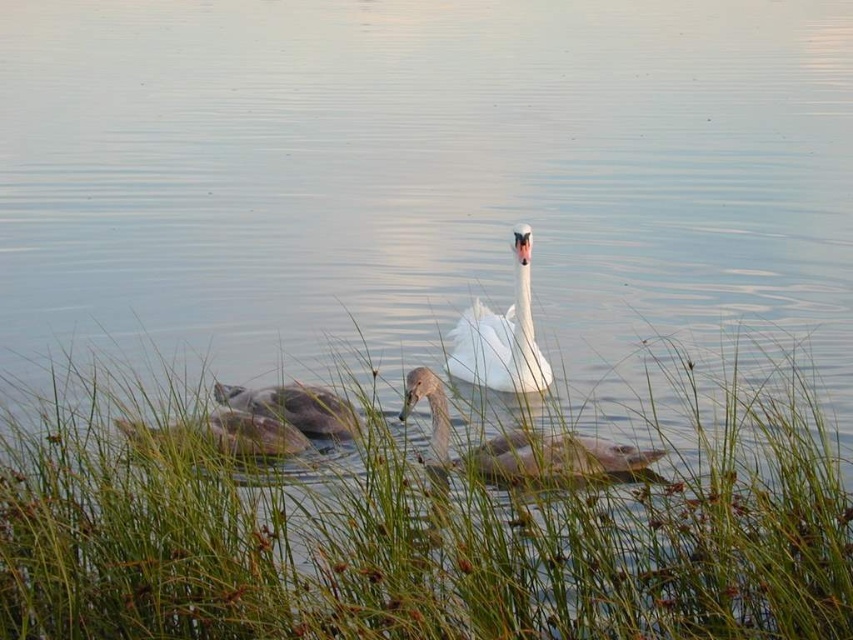
Does green grass at lower center appear on the right side of gray matte duck at lower center?

Correct, you'll find green grass at lower center to the right of gray matte duck at lower center.

Does point (190, 520) lie in front of point (268, 435)?

Yes.

Who is more forward, [410,611] or [277,442]?

Point [410,611]

What are the coordinates of `green grass at lower center` in the screenshot? It's located at (426, 520).

Does green grass at lower center come in front of gray matte duck at lower left?

Yes, green grass at lower center is closer to the viewer.

Does green grass at lower center appear under gray matte duck at lower left?

Indeed, green grass at lower center is positioned under gray matte duck at lower left.

Between point (572, 592) and point (257, 400), which one is positioned in front?

Point (572, 592) is in front.

What are the coordinates of `green grass at lower center` in the screenshot? It's located at (426, 520).

Can you confirm if gray matte duck at center is positioned to the right of gray matte duck at lower left?

Indeed, gray matte duck at center is positioned on the right side of gray matte duck at lower left.

Does gray matte duck at center lie behind gray matte duck at lower left?

No, gray matte duck at center is in front of gray matte duck at lower left.

Is point (492, 467) more distant than point (334, 396)?

No, it is not.

At what (x,y) coordinates should I click in order to perform the action: click on gray matte duck at center. Please return your answer as a coordinate pair (x, y). The image size is (853, 640). Looking at the image, I should click on (523, 445).